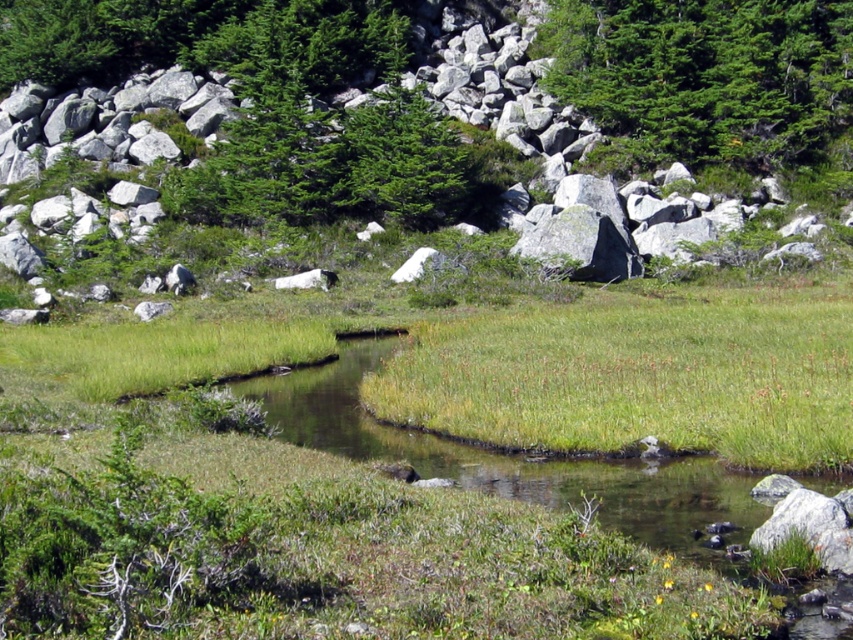
Question: Is green grassy at center wider than green matte tree at upper center?

Choices:
 (A) yes
 (B) no

Answer: (A)

Question: Which of the following is the farthest from the observer?

Choices:
 (A) green matte tree at upper center
 (B) green grassy at center

Answer: (A)

Question: Is green grassy at center positioned at the back of green matte tree at upper center?

Choices:
 (A) yes
 (B) no

Answer: (B)

Question: Is the position of green grassy at center more distant than that of green matte tree at upper center?

Choices:
 (A) yes
 (B) no

Answer: (B)

Question: Which point is farther from the camera taking this photo?

Choices:
 (A) (630, 3)
 (B) (554, 420)

Answer: (A)